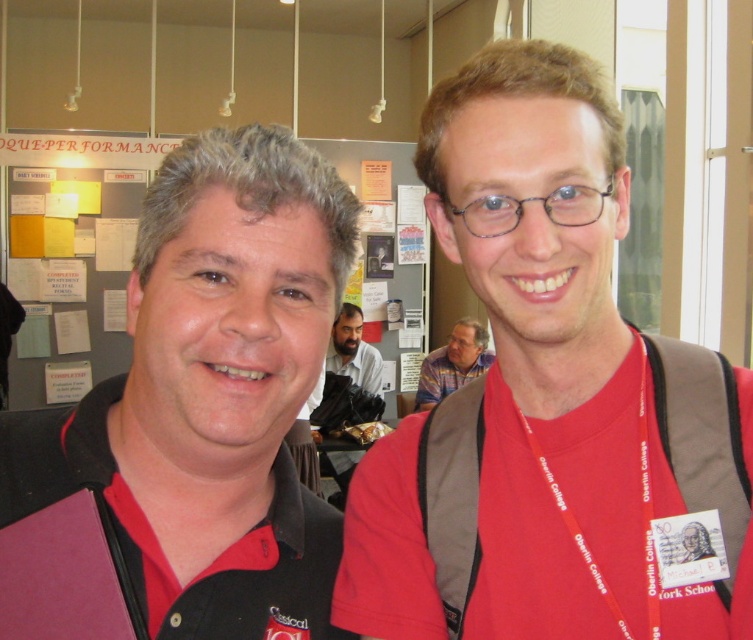
Question: Estimate the real-world distances between objects in this image. Which object is farther from the matte red shirt at center?

Choices:
 (A) striped fabric shirt at center
 (B) matte black polo shirt at left
 (C) bearded man at center
 (D) red lanyard at right

Answer: (C)

Question: Does matte black polo shirt at left have a lesser width compared to bearded man at center?

Choices:
 (A) no
 (B) yes

Answer: (A)

Question: Which is nearer to the striped fabric shirt at center?

Choices:
 (A) matte black polo shirt at left
 (B) bearded man at center
 (C) matte red shirt at center
 (D) red lanyard at right

Answer: (B)

Question: Which object is closer to the camera taking this photo?

Choices:
 (A) matte black polo shirt at left
 (B) striped fabric shirt at center
 (C) red lanyard at right

Answer: (A)

Question: In this image, where is matte black polo shirt at left located relative to striped fabric shirt at center?

Choices:
 (A) right
 (B) left

Answer: (B)

Question: Considering the relative positions of matte black polo shirt at left and red lanyard at right in the image provided, where is matte black polo shirt at left located with respect to red lanyard at right?

Choices:
 (A) above
 (B) below

Answer: (A)